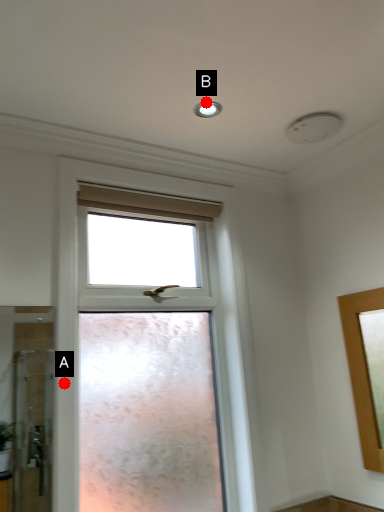
Question: Two points are circled on the image, labeled by A and B beside each circle. Which of the following is the closest to the observer?

Choices:
 (A) A is closer
 (B) B is closer

Answer: (A)